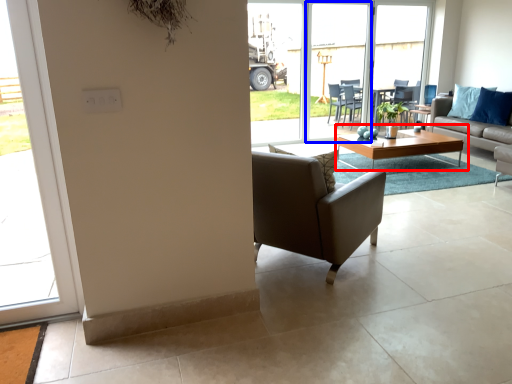
Question: Which point is closer to the camera, coffee table (highlighted by a red box) or screen door (highlighted by a blue box)?

Choices:
 (A) coffee table
 (B) screen door

Answer: (A)